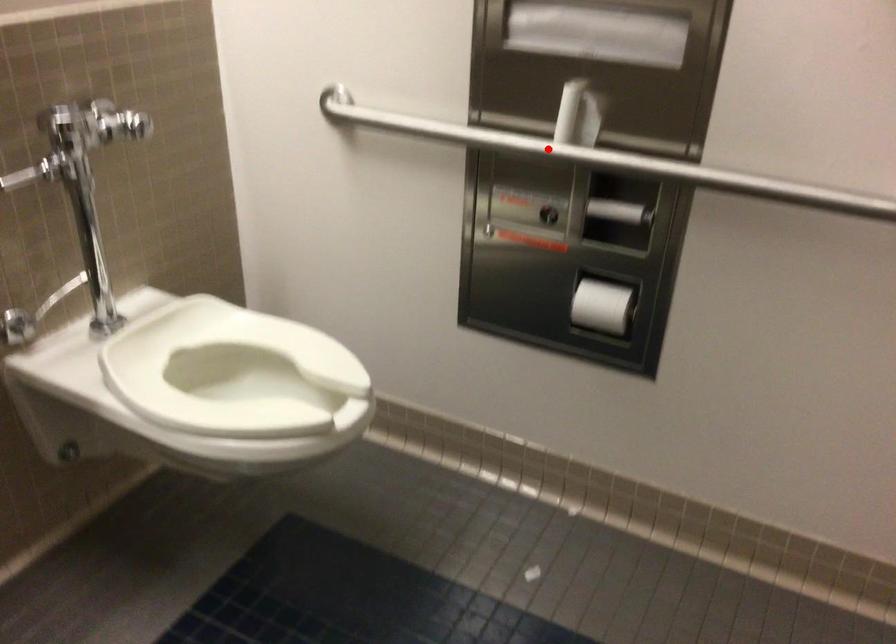
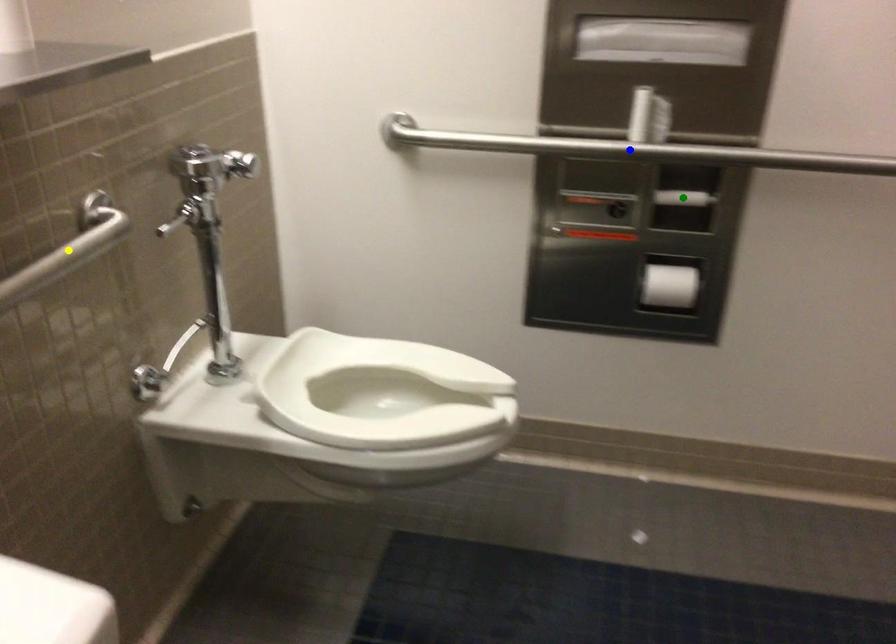
Question: I am providing you with two images of the same scene from different viewpoints. A red point is marked on the first image. You are given multiple points on the second image. Which point in image 2 represents the same 3d spot as the red point in image 1?

Choices:
 (A) green point
 (B) blue point
 (C) yellow point

Answer: (B)